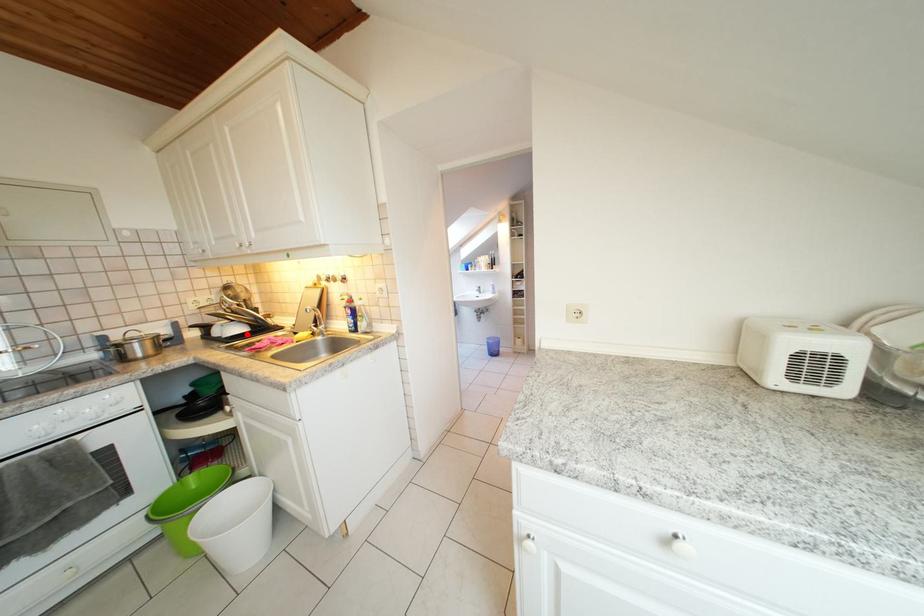
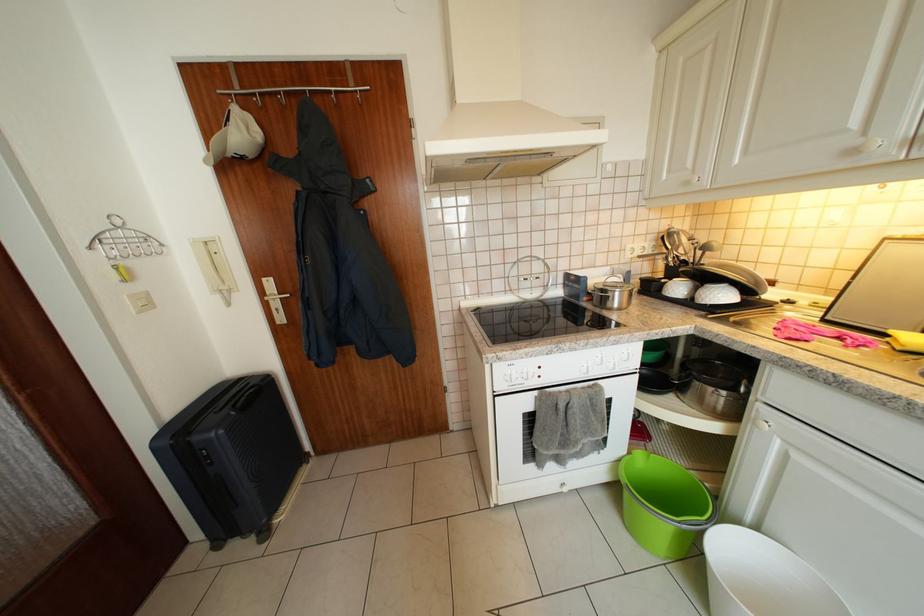
The point at the highlighted location is marked in the first image. Where is the corresponding point in the second image?

(730, 300)